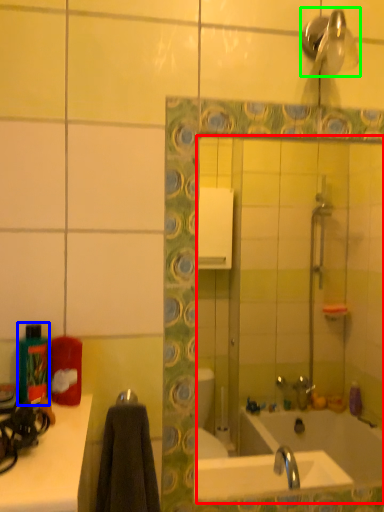
Question: Considering the real-world distances, which object is farthest from mirror (highlighted by a red box)? bottle (highlighted by a blue box) or shower (highlighted by a green box)?

Choices:
 (A) bottle
 (B) shower

Answer: (A)